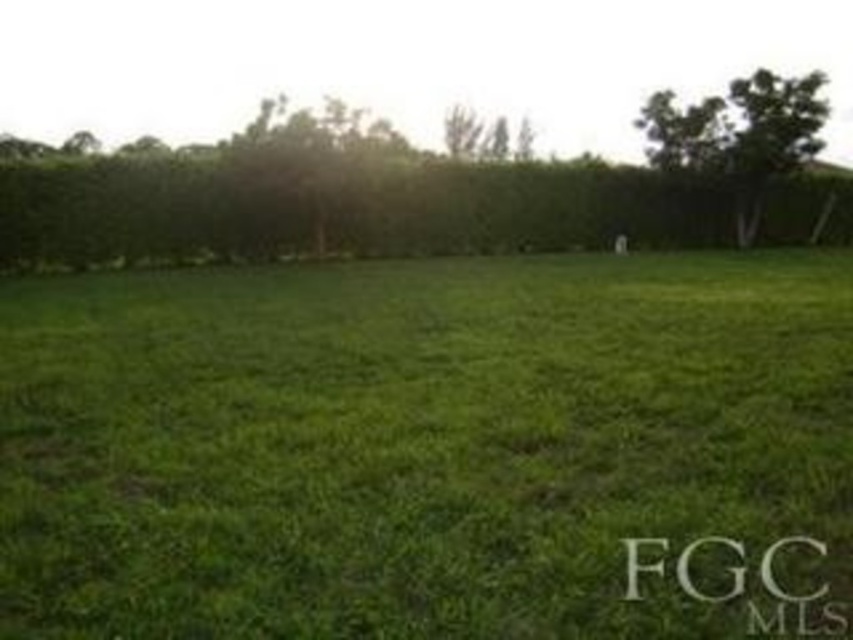
You are standing in the middle of the field and see the green grass at center and the green leafy hedge at upper center. Which object is positioned to the left of the other?

The green grass at center is to the left of the green leafy hedge at upper center.

You are standing in the field and want to take a photo of the green grass at center without any obstruction. Is the green leafy hedge at upper center blocking your view?

The green grass at center is positioned under the green leafy hedge at upper center, so the hedge is blocking the view of the grass.

You are a gardener who needs to trim plants that are taller than 10 inches. Based on the scene, which of the two plants, the green grass at center or the green leafy hedge at upper center, should you prioritize trimming?

The green leafy hedge at upper center should be prioritized for trimming since it is taller than the green grass at center, and the grass is shorter than 10 inches.